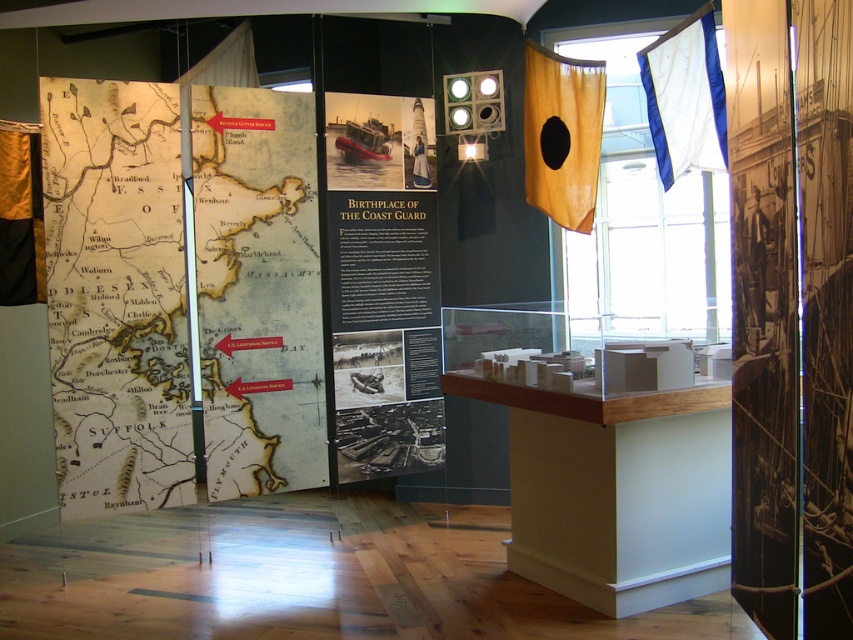
You are a visitor standing in front of the museum exhibit. You notice the white fabric flag at upper right and the yellow paper map at center. Which object is closer to you?

The yellow paper map at center is closer to you because the white fabric flag at upper right is behind it.

You are a visitor standing in front of the museum exhibit. You see the yellow paper map at center and the white fabric flag at upper right. Which object is located more to the left?

The yellow paper map at center is positioned on the left side of the white fabric flag at upper right, so the yellow paper map at center is more to the left.

You are a visitor standing in front of the museum exhibit. You notice two points marked on the map. The first point is at coordinates point (363, 104) and the second point is at point (665, 100). Which point is closer to you?

Point (665, 100) is closer to you because point (363, 104) is behind it.